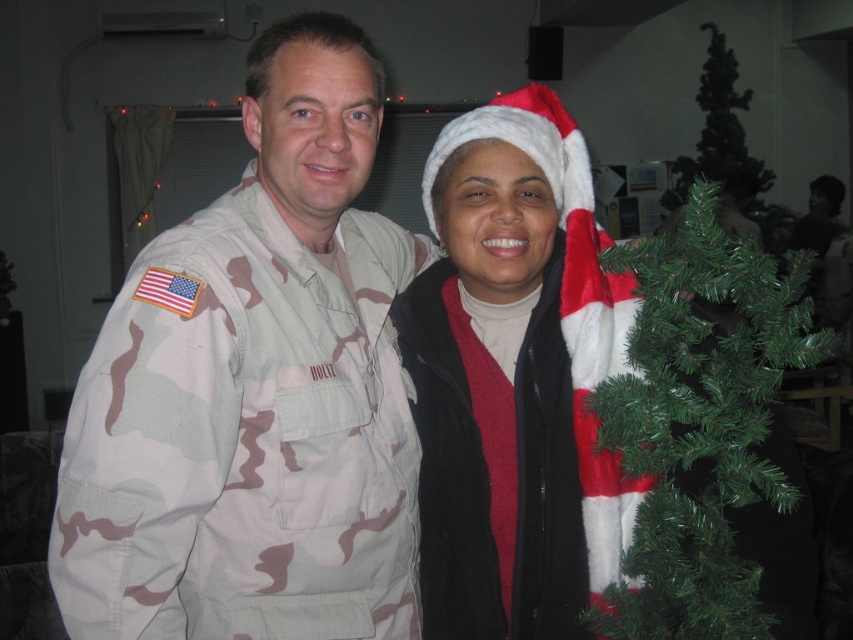
Can you confirm if camo uniform at left is thinner than white fuzzy santa hat at center?

Incorrect, camo uniform at left's width is not less than white fuzzy santa hat at center's.

Is camo uniform at left further to camera compared to white fuzzy santa hat at center?

No.

Who is more distant from viewer, (344, 330) or (436, 166)?

The point (436, 166) is more distant.

Identify the location of camo uniform at left. This screenshot has width=853, height=640. (254, 390).

Can you confirm if camo uniform at left is positioned above green artificial christmas tree at right?

Yes.

Can you confirm if camo uniform at left is positioned below green artificial christmas tree at right?

No.

You are a GUI agent. You are given a task and a screenshot of the screen. Output one action in this format:
    pyautogui.click(x=<x>, y=<y>)
    Task: Click on the camo uniform at left
    The width and height of the screenshot is (853, 640).
    Given the screenshot: What is the action you would take?
    (x=254, y=390)

Find the location of a particular element. This screenshot has height=640, width=853. camo uniform at left is located at coordinates tap(254, 390).

Which is above, white fuzzy santa hat at center or green artificial christmas tree at right?

Positioned higher is white fuzzy santa hat at center.

Who is positioned more to the right, white fuzzy santa hat at center or green artificial christmas tree at right?

Positioned to the right is green artificial christmas tree at right.

Measure the distance between point (473, 609) and camera.

They are 1.20 meters apart.

The width and height of the screenshot is (853, 640). What are the coordinates of `white fuzzy santa hat at center` in the screenshot? It's located at (514, 378).